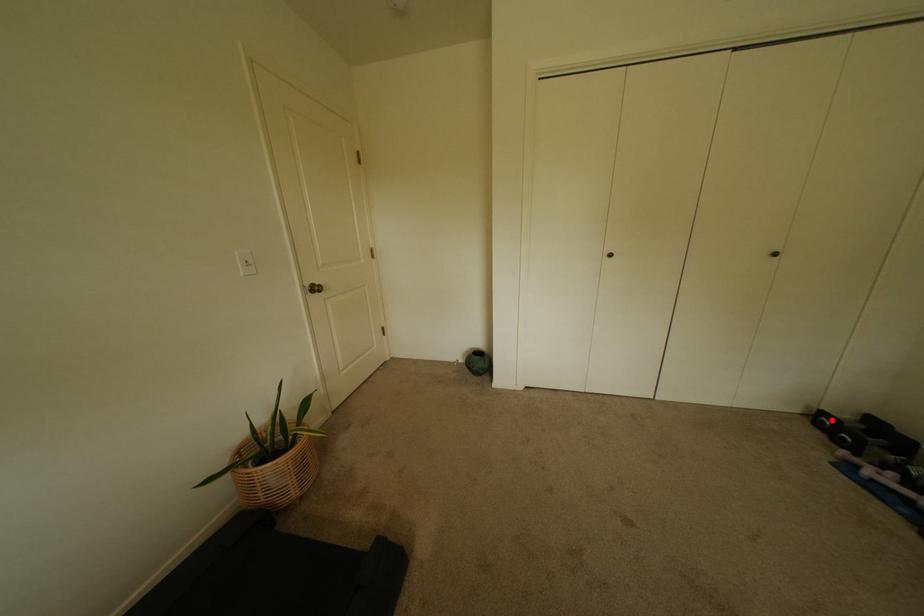
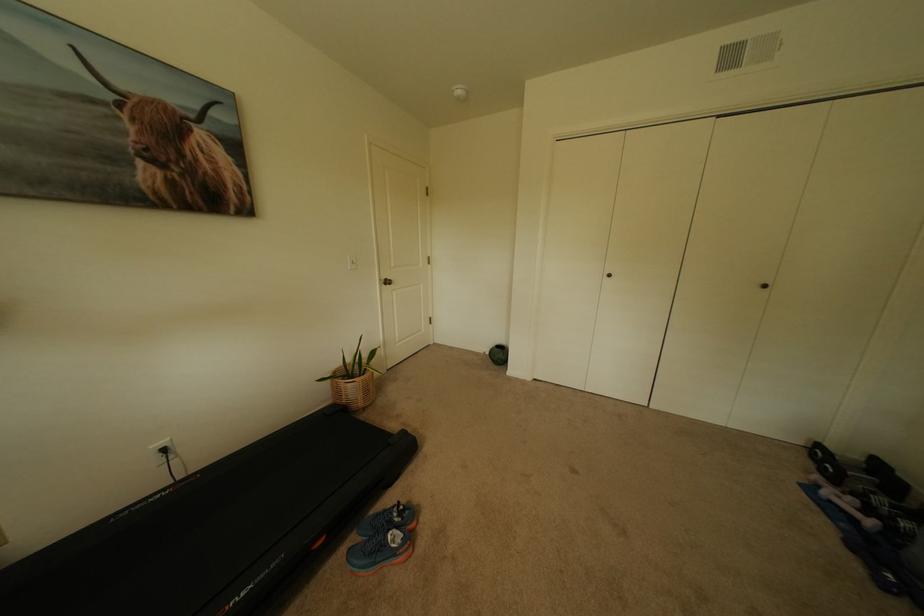
Question: A red point is marked in image1. In image2, is the corresponding 3D point closer to the camera or farther? Reply with the corresponding letter.

Choices:
 (A) The corresponding 3D point is closer.
 (B) The corresponding 3D point is farther.

Answer: (A)